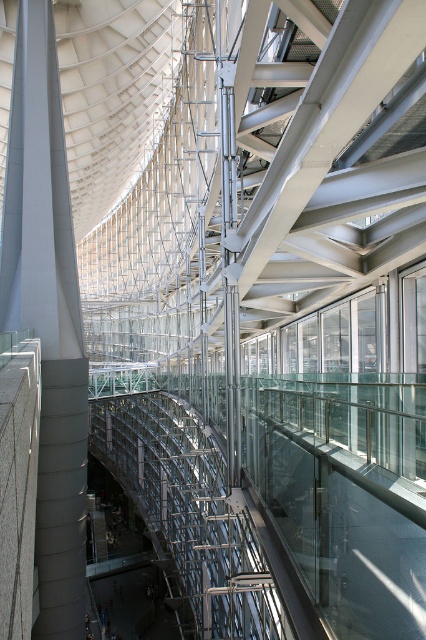
Question: Which point is farther from the camera taking this photo?

Choices:
 (A) (55, 486)
 (B) (204, 577)

Answer: (B)

Question: Can you confirm if smooth gray pillar at left is positioned to the right of transparent glass scaffolding at center?

Choices:
 (A) no
 (B) yes

Answer: (A)

Question: In this image, where is smooth gray pillar at left located relative to transparent glass scaffolding at center?

Choices:
 (A) left
 (B) right

Answer: (A)

Question: Can you confirm if smooth gray pillar at left is wider than transparent glass scaffolding at center?

Choices:
 (A) no
 (B) yes

Answer: (A)

Question: Which point is farther to the camera?

Choices:
 (A) transparent glass scaffolding at center
 (B) smooth gray pillar at left

Answer: (B)